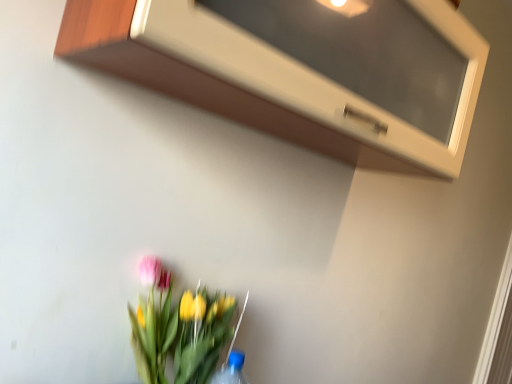
Question: Is white glossy microwave at upper center in front of or behind vibrant floral bouquet at lower center in the image?

Choices:
 (A) behind
 (B) front

Answer: (B)

Question: From a real-world perspective, is white glossy microwave at upper center physically located above or below vibrant floral bouquet at lower center?

Choices:
 (A) above
 (B) below

Answer: (A)

Question: Would you say white glossy microwave at upper center is inside or outside vibrant floral bouquet at lower center?

Choices:
 (A) inside
 (B) outside

Answer: (B)

Question: From a real-world perspective, is vibrant floral bouquet at lower center physically located above or below white glossy microwave at upper center?

Choices:
 (A) above
 (B) below

Answer: (B)

Question: Is point (232, 297) positioned closer to the camera than point (296, 66)?

Choices:
 (A) farther
 (B) closer

Answer: (A)

Question: Considering their positions, is vibrant floral bouquet at lower center located in front of or behind white glossy microwave at upper center?

Choices:
 (A) behind
 (B) front

Answer: (A)

Question: From the image's perspective, is vibrant floral bouquet at lower center above or below white glossy microwave at upper center?

Choices:
 (A) above
 (B) below

Answer: (B)